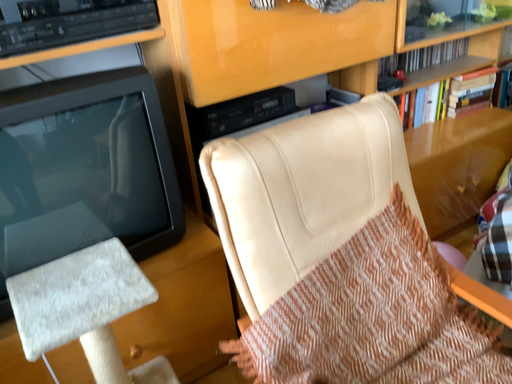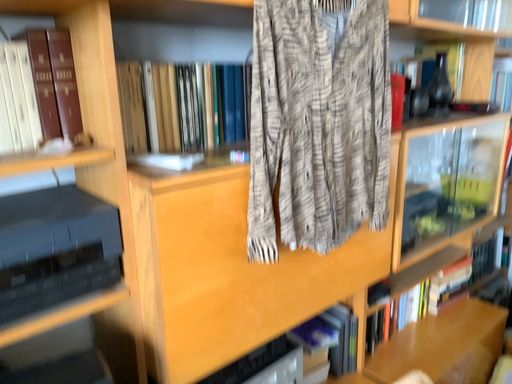
Question: How did the camera likely rotate when shooting the video?

Choices:
 (A) rotated left
 (B) rotated right

Answer: (B)